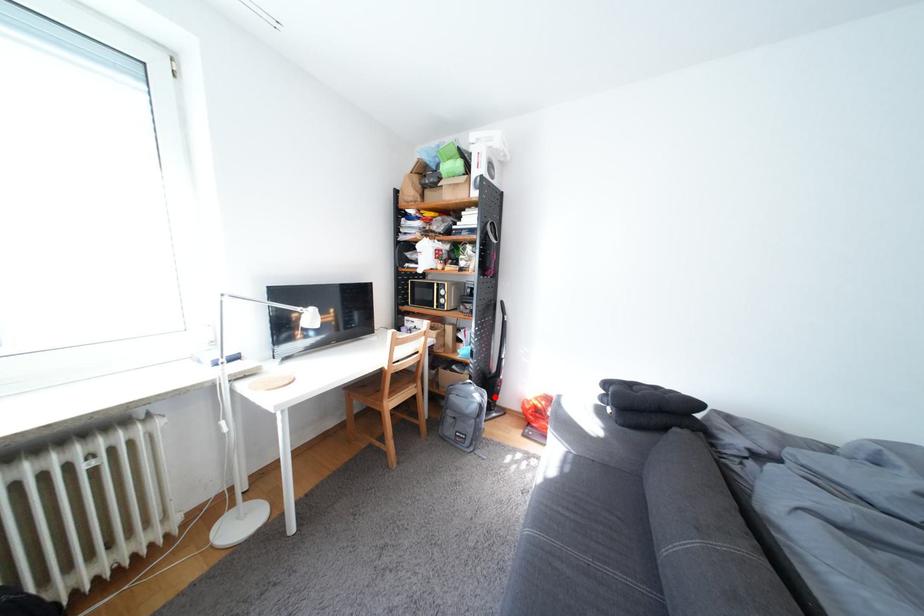
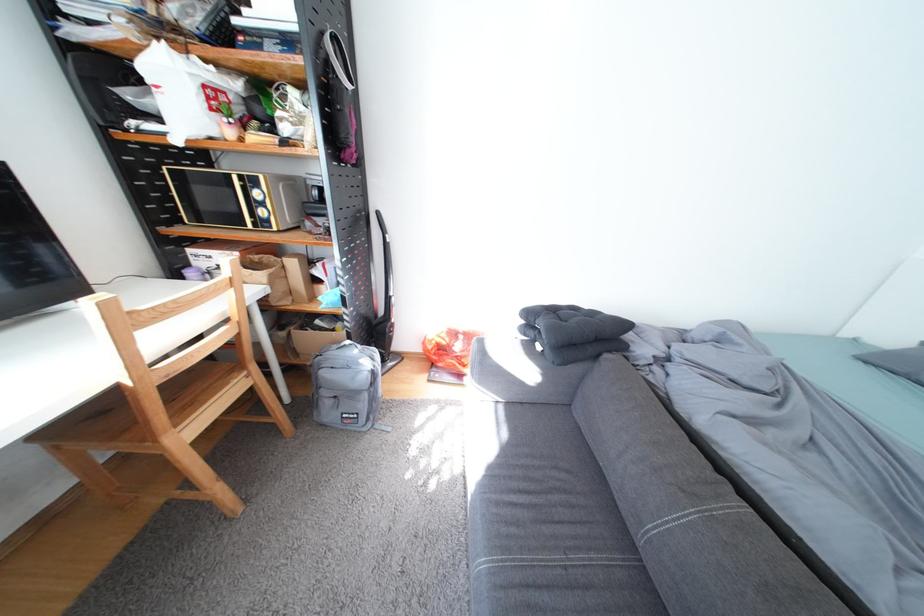
Where in the second image is the point corresponding to the highlighted location from the first image?

(385, 360)